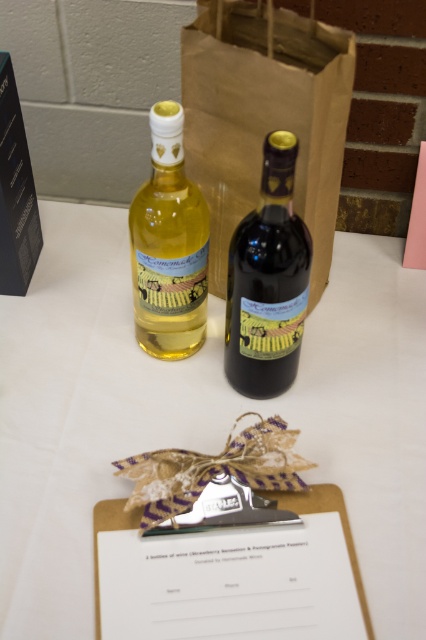
Looking at this image, you are at a wine tasting event and see the brown paper bag at center and the dark glass bottle at center on the table. Which item is covering the other one?

The brown paper bag at center is positioned over the dark glass bottle at center, so it is covering it.

You are organizing a picnic and have a brown paper bag at center and a dark glass bottle at center on your table. Which item can hold more items inside?

The brown paper bag at center is bigger than the dark glass bottle at center, so it can hold more items inside.

You are a delivery person who needs to place a package on the table. The package is 6 inches wide. You see the brown paper bag at center and the matte glass bottle at upper left. Can you fit the package between them without moving either item?

The distance between the brown paper bag at center and the matte glass bottle at upper left is 5.21 inches. Since the package is 6 inches wide, it cannot fit between them as the space is narrower than the package.